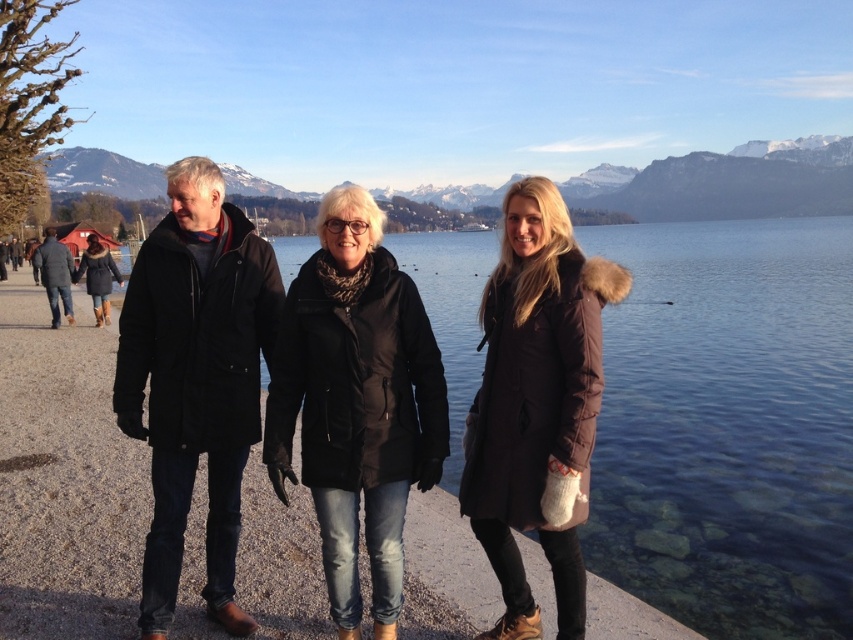
Question: Which of the following is the farthest from the observer?

Choices:
 (A) (71, 192)
 (B) (381, 465)

Answer: (A)

Question: Among these objects, which one is farthest from the camera?

Choices:
 (A) matte black coat at left
 (B) matte black jackets at center

Answer: (A)

Question: Among these objects, which one is nearest to the camera?

Choices:
 (A) matte black coat at left
 (B) matte black jackets at center
 (C) snowy mountain at upper center

Answer: (B)

Question: Is black matte jacket at center positioned at the back of black matte jacket at left?

Choices:
 (A) no
 (B) yes

Answer: (B)

Question: Is snowy mountain at upper center closer to camera compared to dark gray coat at left?

Choices:
 (A) no
 (B) yes

Answer: (A)

Question: Does brown fuzzy coat at center have a smaller size compared to snowy mountain at upper center?

Choices:
 (A) yes
 (B) no

Answer: (A)